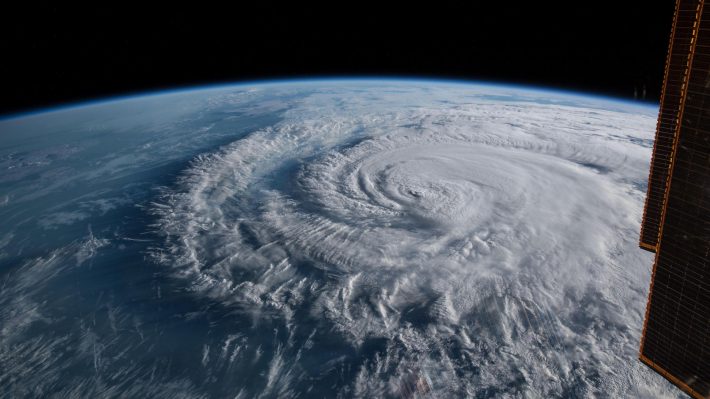
Identify the location of brown boxes. This screenshot has height=399, width=710. (682, 287), (660, 190), (689, 184).